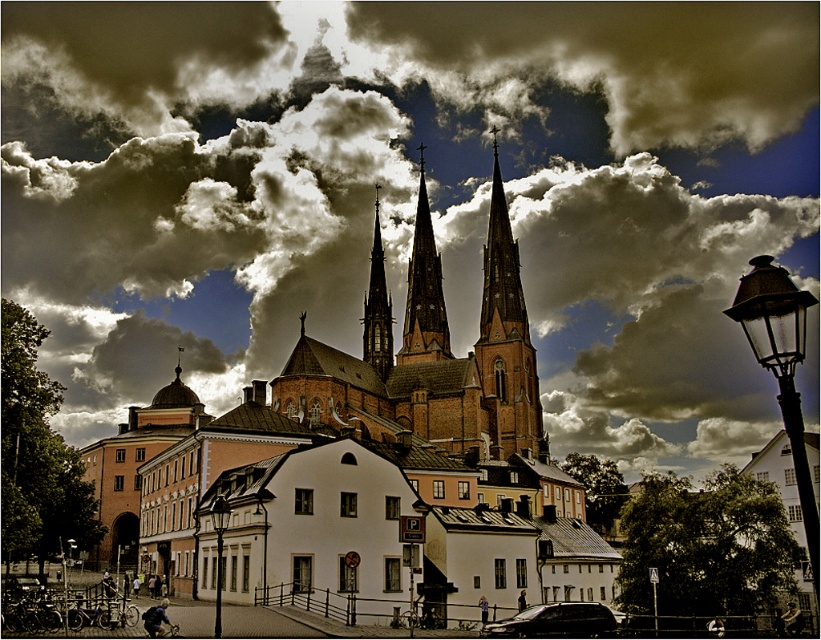
Can you confirm if dark cloudy sky at upper center is positioned to the right of matte black lamp post at right?

In fact, dark cloudy sky at upper center is to the left of matte black lamp post at right.

Is point (636, 180) farther from viewer compared to point (787, 316)?

Yes, point (636, 180) is behind point (787, 316).

Where is `dark cloudy sky at upper center`? The height and width of the screenshot is (640, 821). dark cloudy sky at upper center is located at coordinates (411, 195).

Does point (782, 337) come farther from viewer compared to point (365, 298)?

No.

The height and width of the screenshot is (640, 821). I want to click on matte black lamp post at right, so click(781, 369).

Does dark cloudy sky at upper center have a lesser width compared to brick steeple at center?

Incorrect, dark cloudy sky at upper center's width is not less than brick steeple at center's.

The height and width of the screenshot is (640, 821). Describe the element at coordinates (411, 195) in the screenshot. I see `dark cloudy sky at upper center` at that location.

Is point (21, 173) farther from camera compared to point (491, 381)?

Yes, it is behind point (491, 381).

Locate an element on the screen. This screenshot has height=640, width=821. dark cloudy sky at upper center is located at coordinates (411, 195).